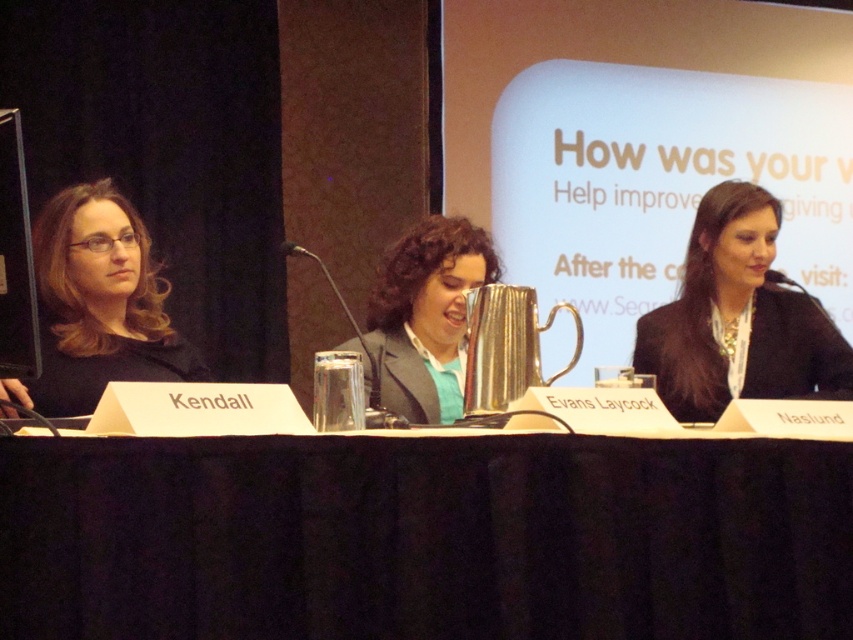
Consider the image. You are attending a conference and need to sit down. There is a black fabric table at center and a black silk blazer at right. Which object is closer to the floor?

The black fabric table at center is closer to the floor because it is below the black silk blazer at right.

You are standing in front of the panel discussion setup and want to determine which of the two points, point (299, 632) or point (120, 195), is nearer to you. Can you identify the closer one?

Point (299, 632) is closer to the viewer than point (120, 195).

You are organizing a panel discussion and need to ensure that all jackets are visible to the audience. Given the setup described, which jacket between the black silk blazer at right and the matte black jacket at left is more likely to be seen by the audience due to its height?

The black silk blazer at right is much taller than the matte black jacket at left, so it will be more visible to the audience.